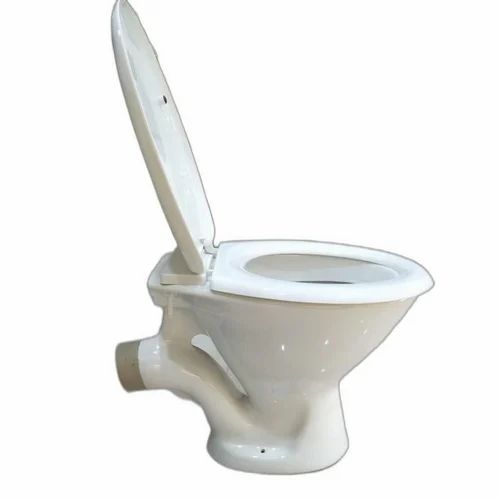
Identify the location of toilet lid stopper. This screenshot has height=500, width=500. (165, 98).